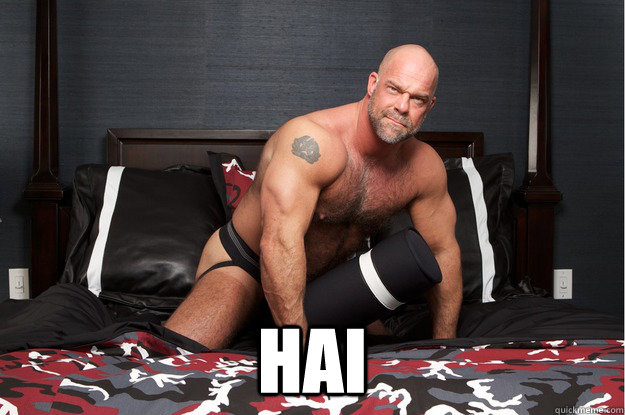
I want to click on headboard, so click(140, 142).